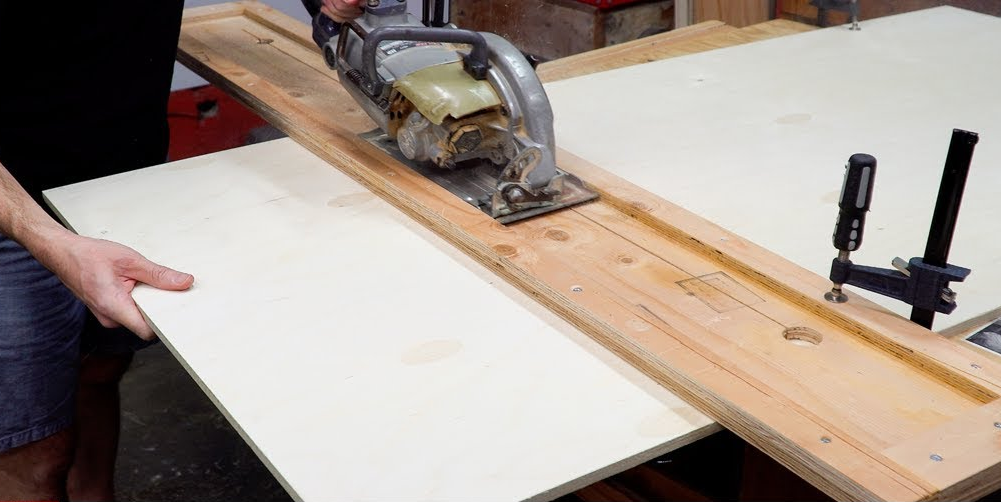
Identify the location of wall. This screenshot has height=502, width=1001. (180, 77).